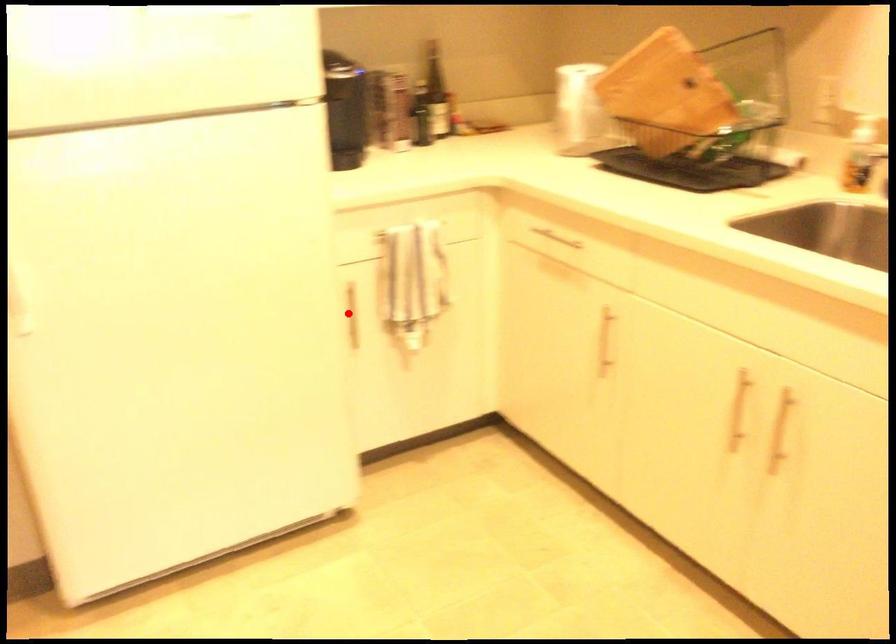
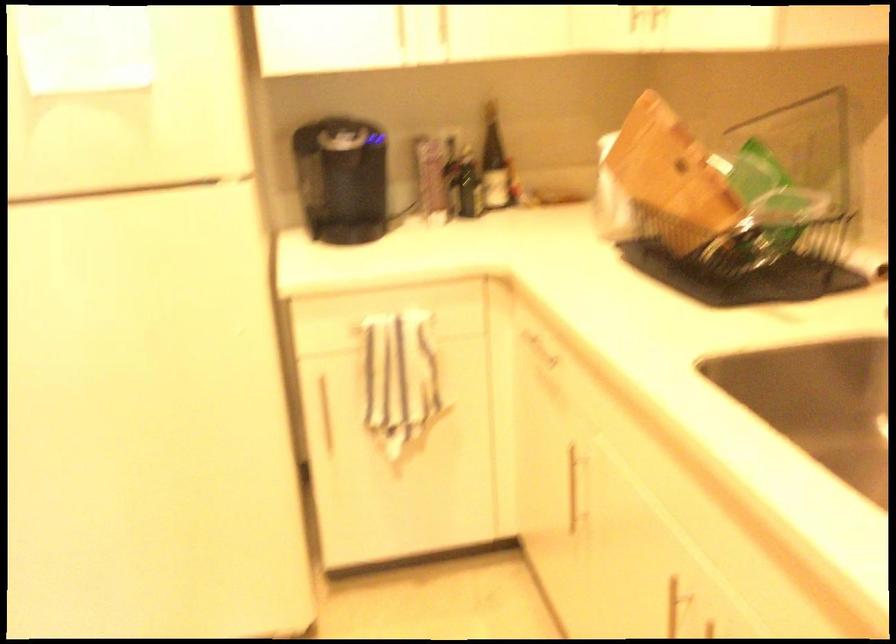
In the second image, find the point that corresponds to the highlighted location in the first image.

(323, 412)